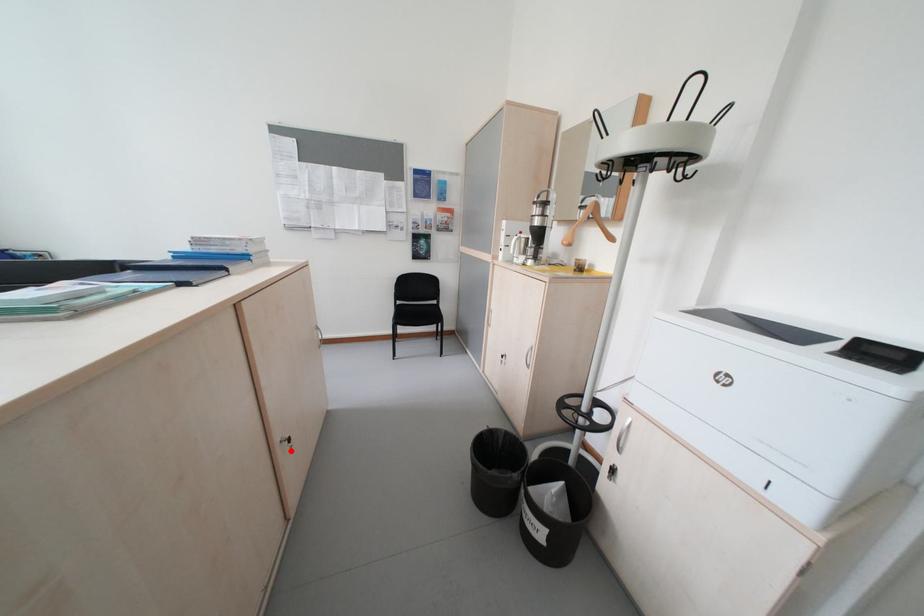
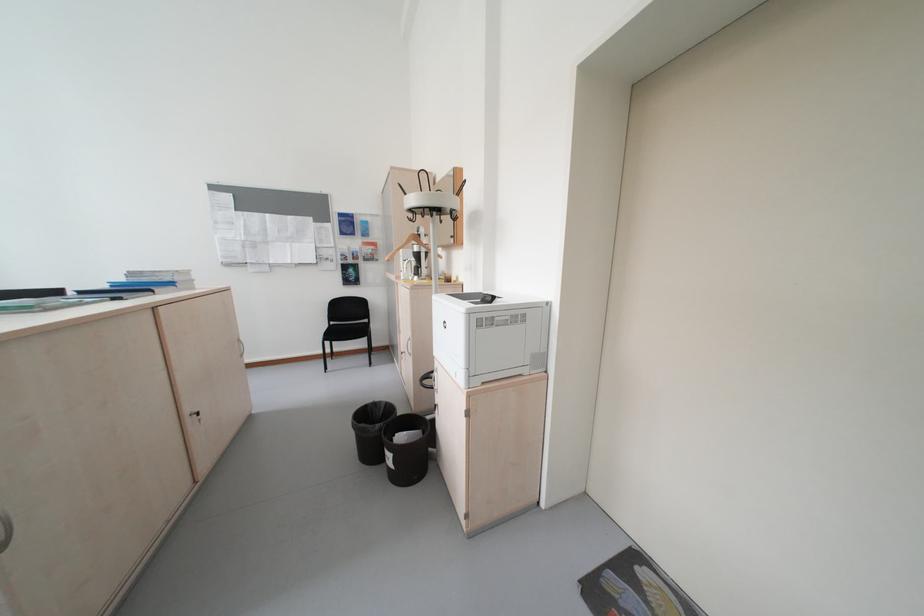
Locate, in the second image, the point that corresponds to the highlighted location in the first image.

(200, 421)